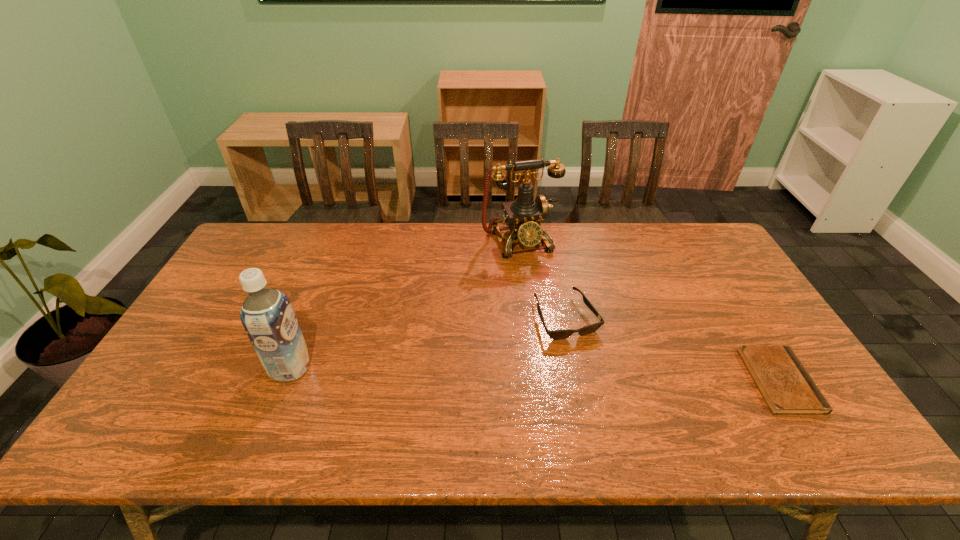
Locate an element on the screen. This screenshot has height=540, width=960. soya milk is located at coordinates (x=267, y=316).

Identify the location of the rightmost object. The image size is (960, 540). (787, 388).

Where is `diary`? The image size is (960, 540). diary is located at coordinates (787, 388).

Where is `the farthest object`? the farthest object is located at coordinates (524, 215).

This screenshot has width=960, height=540. In order to click on the second shortest object in this screenshot , I will do `click(554, 334)`.

Where is `the third nearest object`? Image resolution: width=960 pixels, height=540 pixels. the third nearest object is located at coordinates (554, 334).

The width and height of the screenshot is (960, 540). Find the location of `vacant space situated 0.120m on the label of the soya milk`. vacant space situated 0.120m on the label of the soya milk is located at coordinates (226, 368).

At what (x,y) coordinates should I click in order to perform the action: click on free region located on the label of the soya milk. Please return your answer as a coordinate pair (x, y). The image size is (960, 540). Looking at the image, I should click on (163, 368).

You are a GUI agent. You are given a task and a screenshot of the screen. Output one action in this format:
    pyautogui.click(x=<x>, y=<y>)
    Task: Click on the vacant space located on the label of the soya milk
    The image size is (960, 540).
    Given the screenshot: What is the action you would take?
    pyautogui.click(x=252, y=368)

Find the location of `vacant area situated on the front of the telephone, featuring the rotary dial`. vacant area situated on the front of the telephone, featuring the rotary dial is located at coordinates (568, 337).